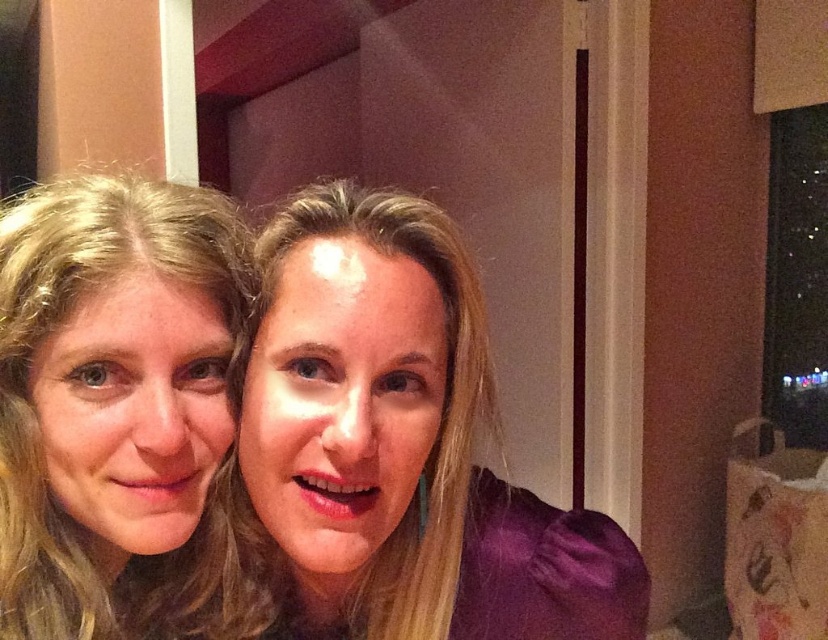
You are a photographer adjusting your camera settings to focus on the purple satin blouse at center and the blonde hair at left. Which object should you focus on first if you want to capture both in the same frame without moving the camera?

You should focus on the blonde hair at left first because the purple satin blouse at center is located below it, so adjusting focus starting from the higher positioned object ensures both can be captured in the frame.

Looking at this image, you are a photographer adjusting the camera settings to ensure both the purple satin blouse at center and the blonde hair at left are in focus. Based on their positions, which one should you focus on first to ensure the other is also in focus?

The purple satin blouse at center is much taller than the blonde hair at left, so focusing on the purple satin blouse at center first will ensure the blonde hair at left is also in focus due to its closer proximity to the camera.